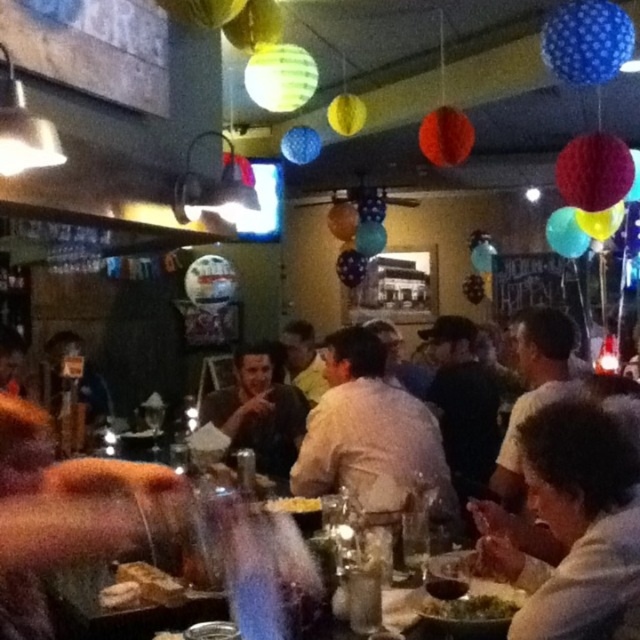
Consider the image. Can you confirm if white matte shirt at lower right is smaller than yellow crumbly food at center?

No.

Is white matte shirt at lower right wider than yellow crumbly food at center?

Yes.

Identify the location of white matte shirt at lower right. (576, 525).

Looking at this image, can you confirm if white matte shirt at lower right is positioned below white cotton shirt at center?

Yes, white matte shirt at lower right is below white cotton shirt at center.

Is white matte shirt at lower right closer to the viewer compared to white cotton shirt at center?

Yes.

Is point (586, 456) positioned behind point (344, 330)?

No, (586, 456) is in front of (344, 330).

You are a GUI agent. You are given a task and a screenshot of the screen. Output one action in this format:
    pyautogui.click(x=<x>, y=<y>)
    Task: Click on the white matte shirt at lower right
    Image resolution: width=640 pixels, height=640 pixels.
    Given the screenshot: What is the action you would take?
    pyautogui.click(x=576, y=525)

Which is more to the left, green leafy salad at center or yellow crumbly food at center?

yellow crumbly food at center is more to the left.

Is green leafy salad at center to the right of yellow crumbly food at center from the viewer's perspective?

Correct, you'll find green leafy salad at center to the right of yellow crumbly food at center.

Identify the location of green leafy salad at center. The height and width of the screenshot is (640, 640). (467, 609).

I want to click on green leafy salad at center, so click(x=467, y=609).